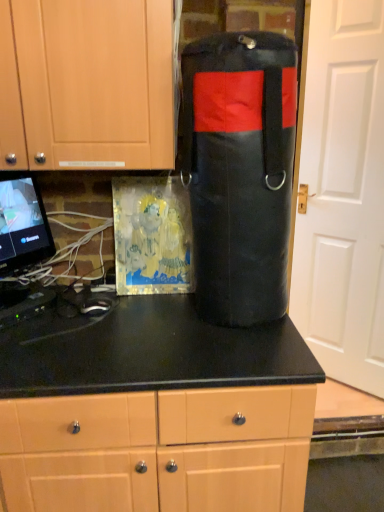
Locate an element on the screen. This screenshot has height=512, width=384. vacant space underneath matte black monitor at left (from a real-world perspective) is located at coordinates (19, 296).